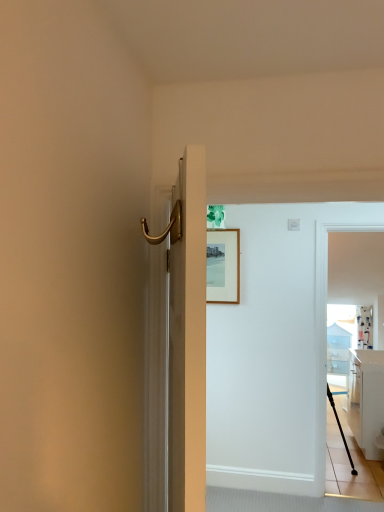
Question: Considering the positions of white fabric curtain at upper right and white glossy screen door at right in the image, is white fabric curtain at upper right taller or shorter than white glossy screen door at right?

Choices:
 (A) short
 (B) tall

Answer: (A)

Question: In terms of width, does white fabric curtain at upper right look wider or thinner when compared to white glossy screen door at right?

Choices:
 (A) thin
 (B) wide

Answer: (A)

Question: Considering the real-world distances, which object is farthest from the wooden picture frame at upper center?

Choices:
 (A) white fabric curtain at upper right
 (B) black rubber cane at right
 (C) white glossy cabinet at right
 (D) white glossy screen door at right
 (E) black matte tripod at lower right

Answer: (A)

Question: Estimate the real-world distances between objects in this image. Which object is closer to the white glossy cabinet at right?

Choices:
 (A) white fabric curtain at upper right
 (B) black matte tripod at lower right
 (C) black rubber cane at right
 (D) wooden picture frame at upper center
 (E) white glossy screen door at right

Answer: (B)